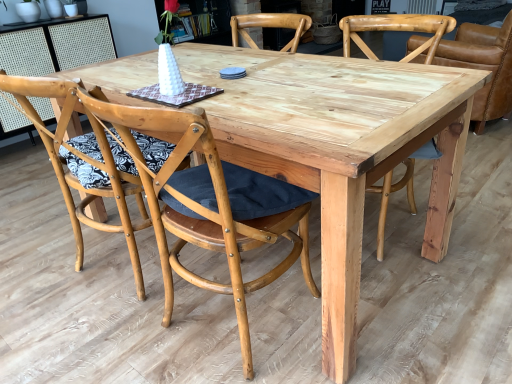
The height and width of the screenshot is (384, 512). In order to click on free location to the right of natural wood chair at center, the 2th chair from the left in this screenshot , I will do `click(388, 322)`.